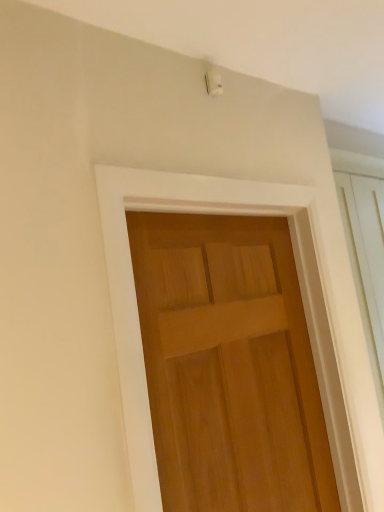
Image resolution: width=384 pixels, height=512 pixels. Describe the element at coordinates (229, 366) in the screenshot. I see `wooden door at center` at that location.

In order to face wooden door at center, should I rotate leftwards or rightwards?

Turn right by 6.988 degrees to look at wooden door at center.

Where is `wooden door at center`? This screenshot has height=512, width=384. wooden door at center is located at coordinates (229, 366).

I want to click on wooden door at center, so click(229, 366).